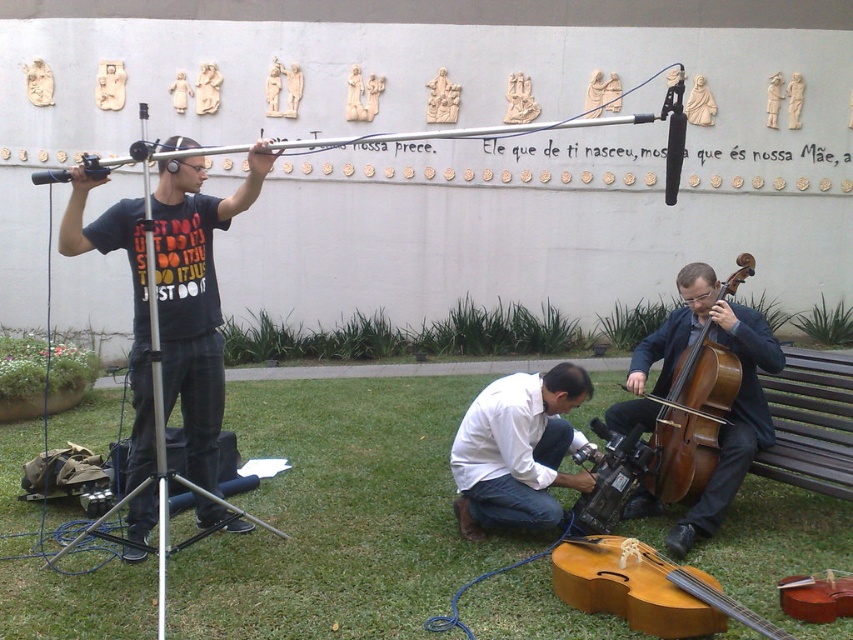
Question: Which point appears farthest from the camera in this image?

Choices:
 (A) (466, 525)
 (B) (102, 237)
 (C) (590, 605)
 (D) (850, 589)

Answer: (A)

Question: Where is black matte t-shirt at upper left located in relation to light brown wood violin at lower center in the image?

Choices:
 (A) left
 (B) right

Answer: (A)

Question: Among these objects, which one is farthest from the camera?

Choices:
 (A) black matte t-shirt at upper left
 (B) light brown wood violin at lower center

Answer: (A)

Question: Does brown wooden cello at lower right appear on the right side of wooden violin at lower right?

Choices:
 (A) yes
 (B) no

Answer: (B)

Question: Can you confirm if brown wooden cello at lower right is smaller than wooden violin at lower right?

Choices:
 (A) yes
 (B) no

Answer: (B)

Question: Based on their relative distances, which object is farther from the white matte shirt at center?

Choices:
 (A) wooden violin at lower right
 (B) black matte t-shirt at upper left
 (C) light brown wood violin at lower center

Answer: (B)